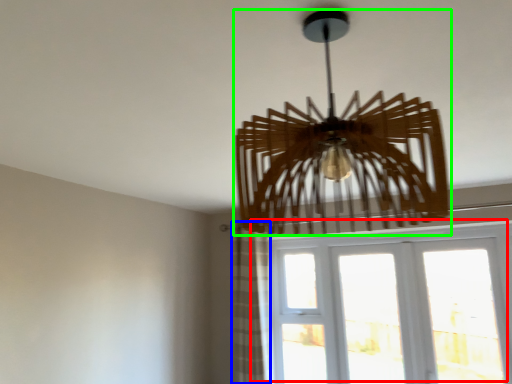
Question: Which object is the closest to the window (highlighted by a red box)? Choose among these: curtain (highlighted by a blue box) or lamp (highlighted by a green box).

Choices:
 (A) curtain
 (B) lamp

Answer: (A)